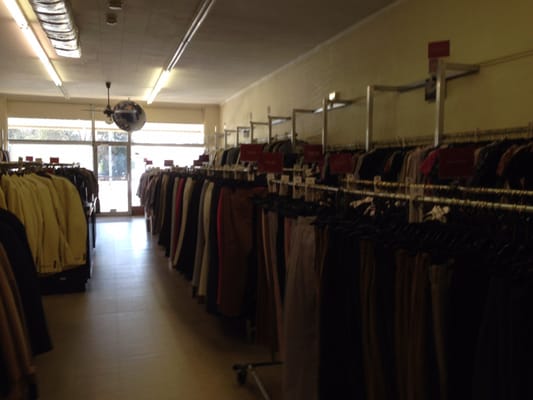
Locate an element on the screen. mirror is located at coordinates (126, 129).